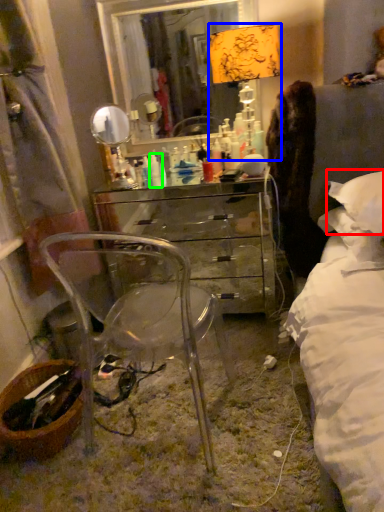
Question: Which object is the closest to the pillow (highlighted by a red box)? Choose among these: table lamp (highlighted by a blue box) or toiletry (highlighted by a green box).

Choices:
 (A) table lamp
 (B) toiletry

Answer: (A)